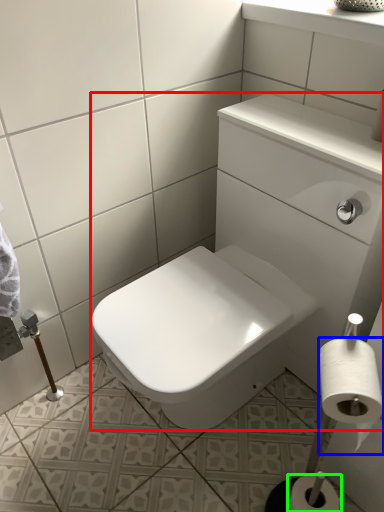
Question: Which object is the closest to the sink (highlighted by a red box)? Choose among these: toilet paper (highlighted by a blue box) or toilet paper (highlighted by a green box).

Choices:
 (A) toilet paper
 (B) toilet paper

Answer: (A)